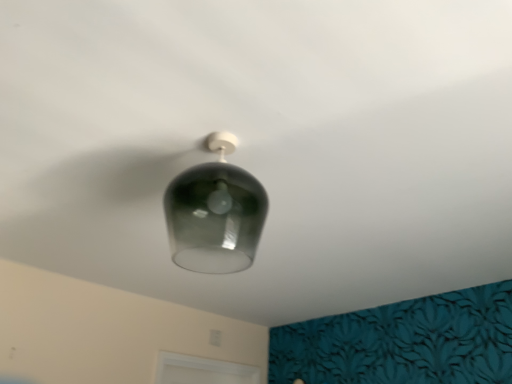
Question: In which direction should I rotate to look at transparent glass lampshade at upper center?

Choices:
 (A) right
 (B) left

Answer: (B)